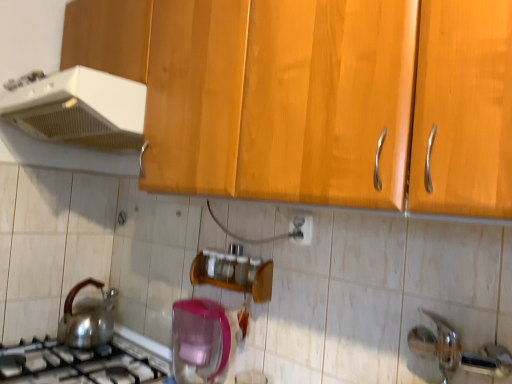
Question: Does white glossy electric outlet at center have a greater width compared to satin silver gas stove at lower left?

Choices:
 (A) yes
 (B) no

Answer: (B)

Question: Can you confirm if white glossy electric outlet at center is thinner than satin silver gas stove at lower left?

Choices:
 (A) yes
 (B) no

Answer: (A)

Question: Would you consider white glossy electric outlet at center to be distant from satin silver gas stove at lower left?

Choices:
 (A) yes
 (B) no

Answer: (B)

Question: Does white glossy electric outlet at center have a greater height compared to satin silver gas stove at lower left?

Choices:
 (A) yes
 (B) no

Answer: (B)

Question: Can you confirm if white glossy electric outlet at center is positioned to the right of satin silver gas stove at lower left?

Choices:
 (A) yes
 (B) no

Answer: (A)

Question: In terms of width, does translucent plastic container at lower center, the third kitchen appliance viewed from the top, look wider or thinner when compared to white plastic range hood at upper left, arranged as the first kitchen appliance when viewed from the top?

Choices:
 (A) wide
 (B) thin

Answer: (B)

Question: From a real-world perspective, is translucent plastic container at lower center, the third kitchen appliance viewed from the top, above or below white plastic range hood at upper left, which is counted as the 3th kitchen appliance, starting from the bottom?

Choices:
 (A) below
 (B) above

Answer: (A)

Question: Considering the positions of point (x=222, y=347) and point (x=97, y=99), is point (x=222, y=347) closer or farther from the camera than point (x=97, y=99)?

Choices:
 (A) farther
 (B) closer

Answer: (A)

Question: From the image's perspective, is translucent plastic container at lower center, the third kitchen appliance viewed from the top, above or below white plastic range hood at upper left, which is counted as the 3th kitchen appliance, starting from the bottom?

Choices:
 (A) below
 (B) above

Answer: (A)

Question: In the image, is satin silver gas stove at lower left on the left side or the right side of wooden spice rack at center?

Choices:
 (A) right
 (B) left

Answer: (B)

Question: Which is correct: satin silver gas stove at lower left is inside wooden spice rack at center, or outside of it?

Choices:
 (A) outside
 (B) inside

Answer: (A)

Question: In terms of height, does satin silver gas stove at lower left look taller or shorter compared to wooden spice rack at center?

Choices:
 (A) tall
 (B) short

Answer: (A)

Question: Does point (134, 364) appear closer or farther from the camera than point (222, 284)?

Choices:
 (A) farther
 (B) closer

Answer: (A)

Question: From the image's perspective, is white glossy electric outlet at center located above or below wooden spice rack at center?

Choices:
 (A) below
 (B) above

Answer: (B)

Question: In the image, is white glossy electric outlet at center on the left side or the right side of wooden spice rack at center?

Choices:
 (A) right
 (B) left

Answer: (A)